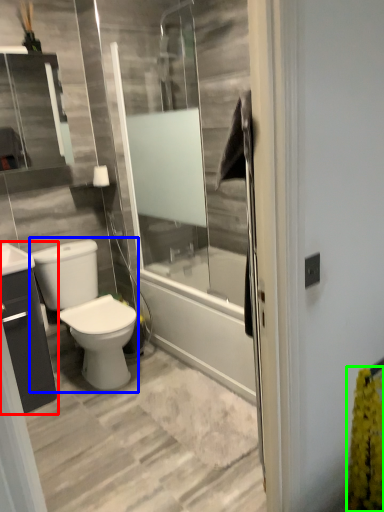
Question: Estimate the real-world distances between objects in this image. Which object is farther from bathroom cabinet (highlighted by a red box), gray (highlighted by a blue box) or flower (highlighted by a green box)?

Choices:
 (A) gray
 (B) flower

Answer: (B)